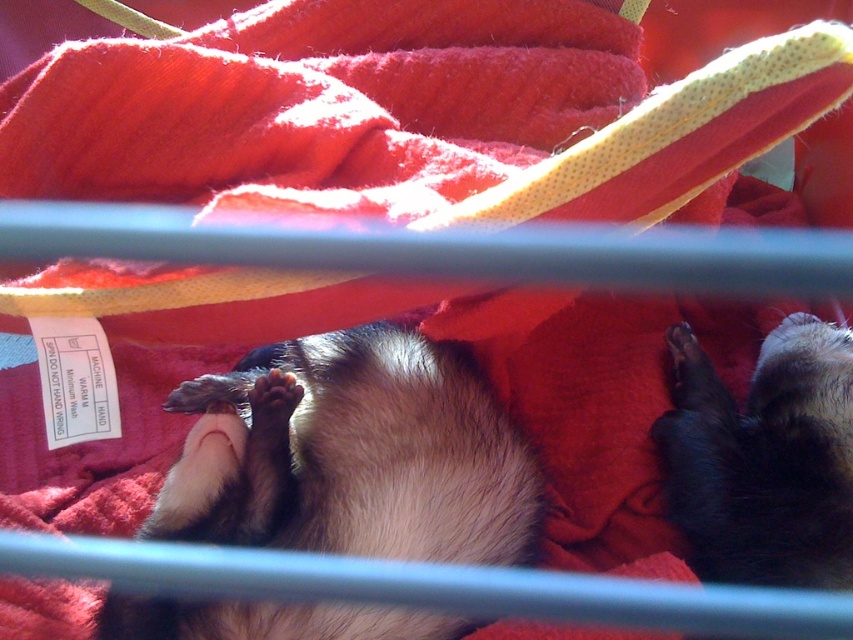
Question: Among these points, which one is farthest from the camera?

Choices:
 (A) (767, 532)
 (B) (233, 493)

Answer: (A)

Question: From the image, what is the correct spatial relationship of fuzzy fur animal at center in relation to black fur animal at lower right?

Choices:
 (A) right
 (B) left

Answer: (B)

Question: Can you confirm if fuzzy fur animal at center is thinner than black fur animal at lower right?

Choices:
 (A) no
 (B) yes

Answer: (A)

Question: Among these objects, which one is nearest to the camera?

Choices:
 (A) fuzzy fur animal at center
 (B) black fur animal at lower right

Answer: (A)

Question: Is fuzzy fur animal at center below black fur animal at lower right?

Choices:
 (A) yes
 (B) no

Answer: (A)

Question: Among these points, which one is nearest to the camera?

Choices:
 (A) (448, 410)
 (B) (819, 554)

Answer: (B)